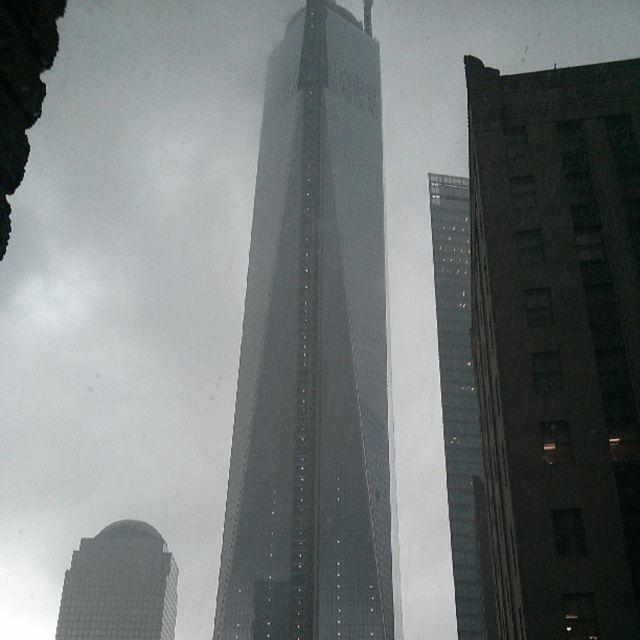
Who is lower down, glassy steel skyscraper at center or glassy reflective skyscraper at lower left?

Positioned lower is glassy reflective skyscraper at lower left.

Measure the distance between point (246, 394) and camera.

Point (246, 394) is 583.72 feet away from camera.

The image size is (640, 640). I want to click on glassy steel skyscraper at center, so point(312,353).

Locate an element on the screen. glassy steel skyscraper at center is located at coordinates (312, 353).

Who is more distant from viewer, (595, 637) or (452, 282)?

Point (452, 282)

Which is in front, point (522, 465) or point (433, 182)?

Point (522, 465) is more forward.

Where is `dark gray concrete building at right`? This screenshot has height=640, width=640. dark gray concrete building at right is located at coordinates (557, 342).

Looking at this image, is glassy steel skyscraper at center bigger than transparent glass tower at center?

Yes.

From the picture: Does glassy steel skyscraper at center appear on the left side of transparent glass tower at center?

Indeed, glassy steel skyscraper at center is positioned on the left side of transparent glass tower at center.

Is point (272, 163) behind point (467, 595)?

Yes, it is.

At what (x,y) coordinates should I click in order to perform the action: click on glassy steel skyscraper at center. Please return your answer as a coordinate pair (x, y). The width and height of the screenshot is (640, 640). Looking at the image, I should click on pos(312,353).